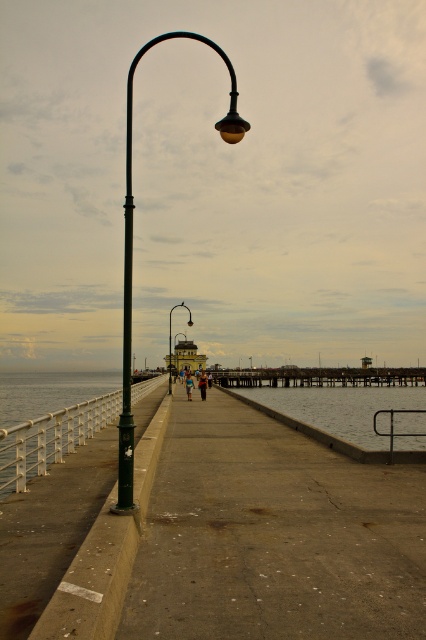
Question: Among these objects, which one is nearest to the camera?

Choices:
 (A) blue denim jeans at center
 (B) black metal rail at lower center

Answer: (B)

Question: Can you confirm if white metal/rail at lower left is positioned to the right of green matte lamp post at left?

Choices:
 (A) no
 (B) yes

Answer: (B)

Question: Is blue fabric person at center bigger than matte black street light at left?

Choices:
 (A) yes
 (B) no

Answer: (B)

Question: Which point is closer to the camera?

Choices:
 (A) (187, 394)
 (B) (131, 346)

Answer: (B)

Question: Which is farther from the blue fabric person at center?

Choices:
 (A) metallic pole at center
 (B) matte black street light at left
 (C) concrete dock at center
 (D) clear water at lower center

Answer: (A)

Question: Does white metal/rail at lower left appear on the left side of black metal rail at lower center?

Choices:
 (A) yes
 (B) no

Answer: (A)